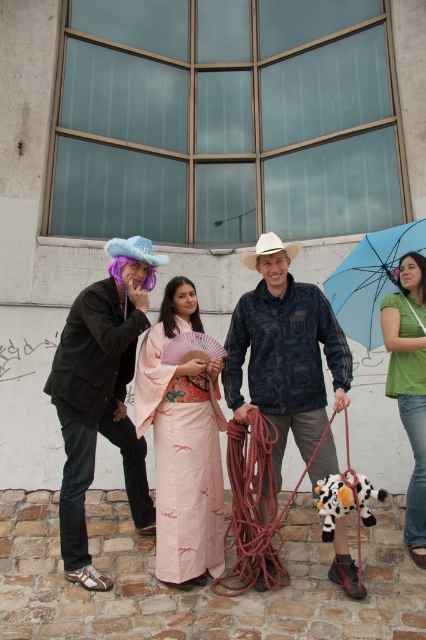
Question: Which object appears farthest from the camera in this image?

Choices:
 (A) blue velvet cowboy hat at left
 (B) pale pink silk kimono at center

Answer: (A)

Question: Does pale pink silk kimono at center lie in front of white plush cow at lower center?

Choices:
 (A) no
 (B) yes

Answer: (A)

Question: Can you confirm if pale pink silk kimono at center is positioned to the left of blue fabric umbrella at upper right?

Choices:
 (A) no
 (B) yes

Answer: (B)

Question: Which object is positioned closest to the blue velvet cowboy hat at left?

Choices:
 (A) pale pink silk kimono at center
 (B) blue fabric umbrella at upper right
 (C) matte black jacket at left
 (D) white plush cow at lower center

Answer: (C)

Question: Does pale pink silk kimono at center have a larger size compared to white matte cowboy hat at center?

Choices:
 (A) no
 (B) yes

Answer: (B)

Question: Which object is positioned closest to the blue patterned jacket at center?

Choices:
 (A) white matte cowboy hat at center
 (B) white plush cow at lower center

Answer: (B)